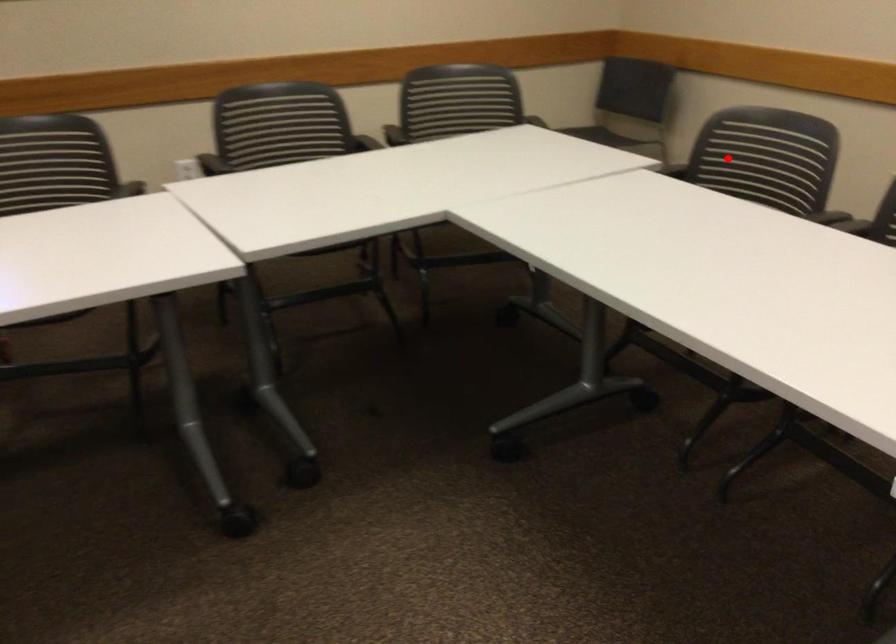
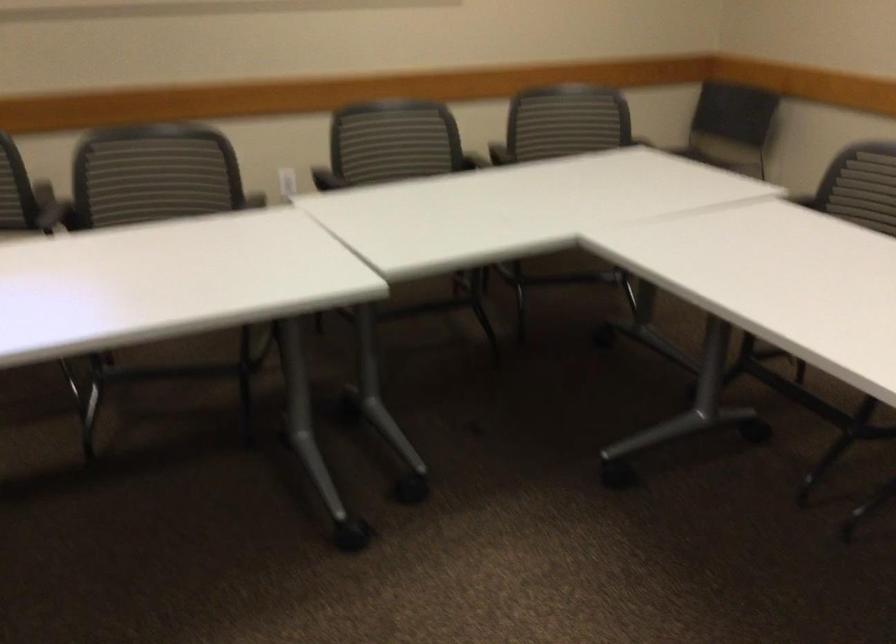
Locate, in the second image, the point that corresponds to the highlighted location in the first image.

(866, 185)